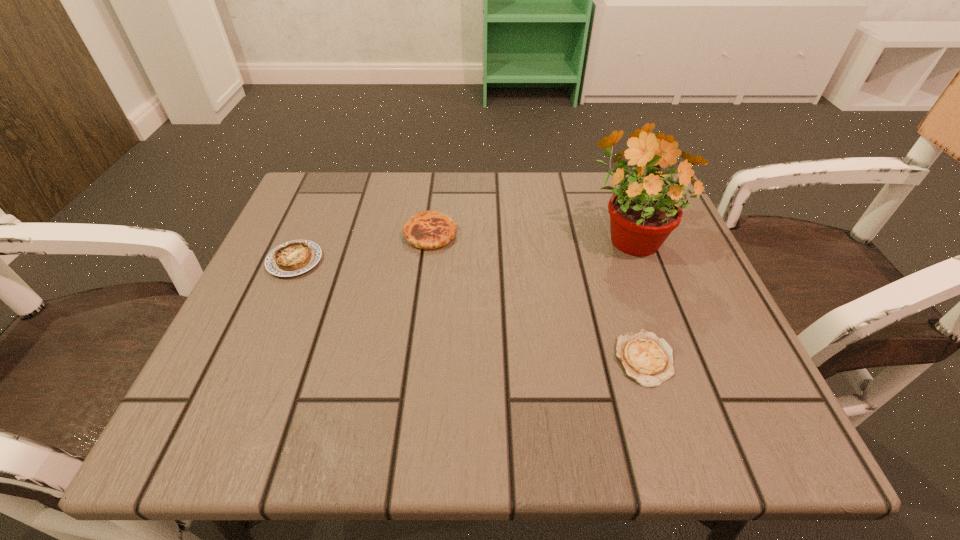
I want to click on the tallest object, so click(643, 213).

I want to click on the tallest quiche, so click(x=426, y=230).

This screenshot has width=960, height=540. In order to click on the second quiche from left to right in this screenshot , I will do `click(426, 230)`.

Identify the location of the leftmost quiche. This screenshot has height=540, width=960. (292, 258).

Image resolution: width=960 pixels, height=540 pixels. What are the coordinates of `the second shortest object` in the screenshot? It's located at (292, 258).

You are a GUI agent. You are given a task and a screenshot of the screen. Output one action in this format:
    pyautogui.click(x=<x>, y=<y>)
    Task: Click on the nearest object
    This screenshot has width=960, height=540.
    Given the screenshot: What is the action you would take?
    pyautogui.click(x=645, y=358)

The width and height of the screenshot is (960, 540). What are the coordinates of `the nearest quiche` in the screenshot? It's located at (645, 358).

Where is `vacant space situated on the left of the tallest object`? vacant space situated on the left of the tallest object is located at coordinates (443, 235).

Identify the location of free space located 0.050m on the right of the tallest quiche. (480, 233).

This screenshot has height=540, width=960. I want to click on blank area located 0.230m on the front of the leftmost object, so 240,386.